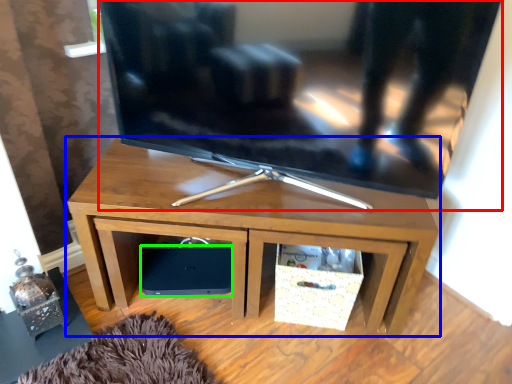
Question: Estimate the real-world distances between objects in this image. Which object is closer to television (highlighted by a red box), desk (highlighted by a blue box) or speaker (highlighted by a green box)?

Choices:
 (A) desk
 (B) speaker

Answer: (A)